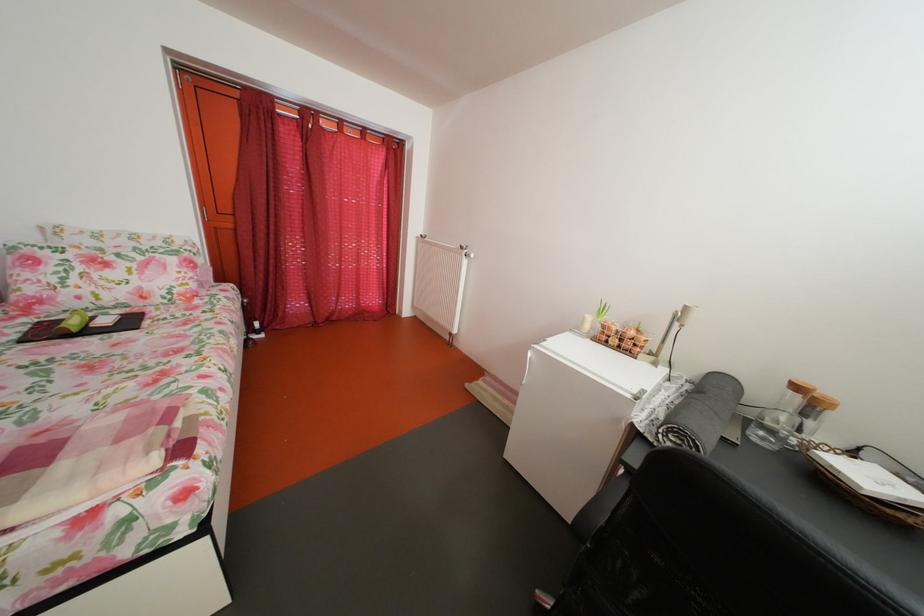
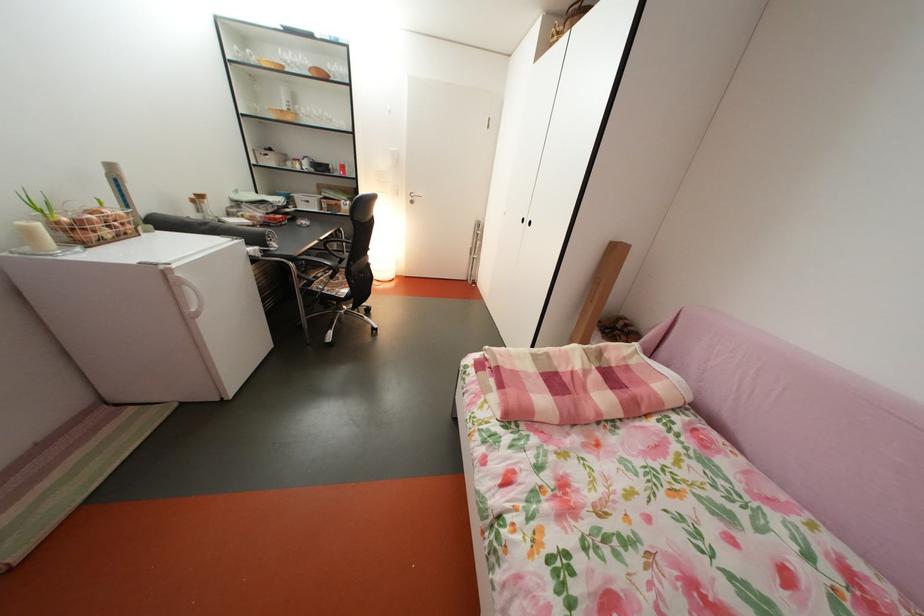
Locate, in the second image, the point that corresponds to (x=594, y=325) in the first image.

(41, 238)